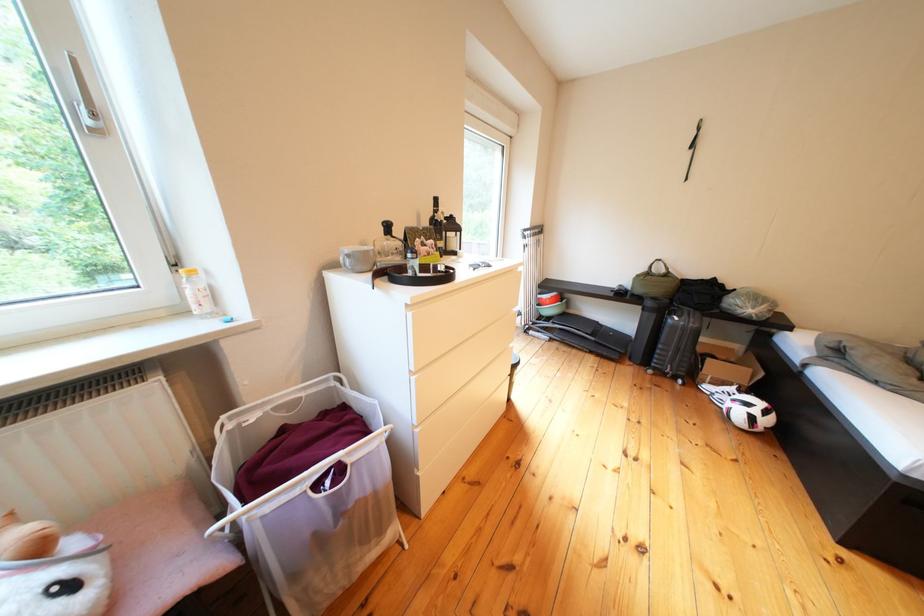
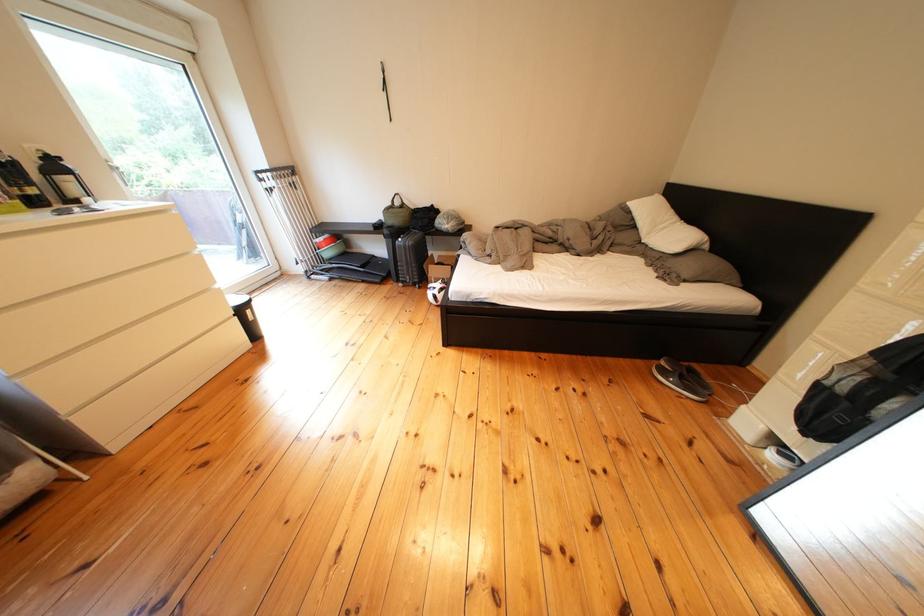
Locate, in the second image, the point that corresponds to [663,308] in the first image.

(399, 236)